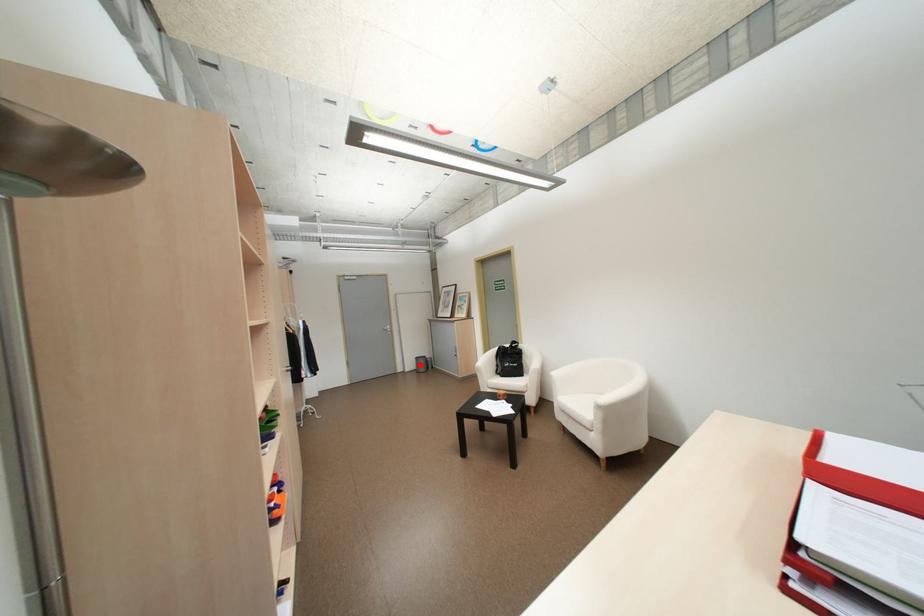
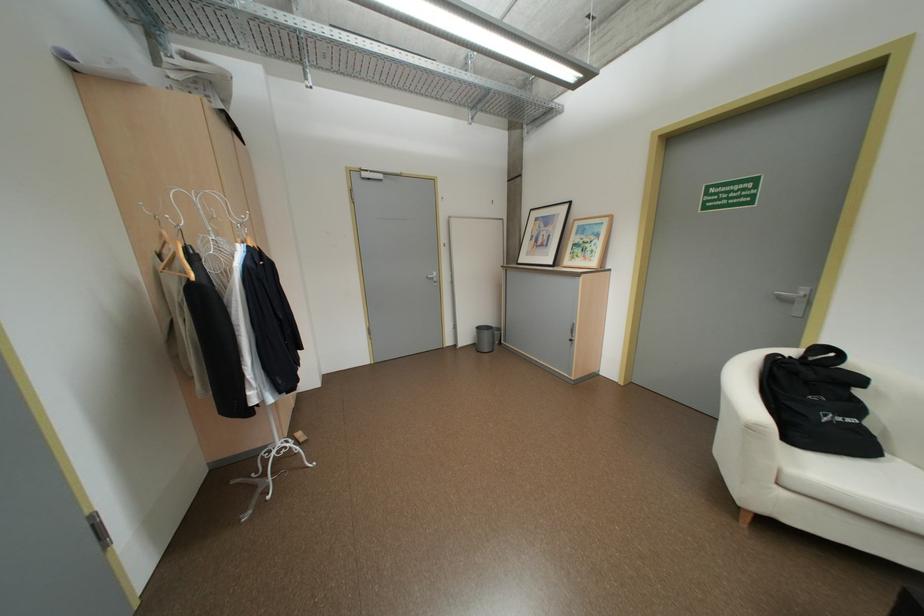
Question: I am providing you with two images of the same scene from different viewpoints. In image1, a red point is highlighted. Considering the same 3D point in image2, which of the following is correct?

Choices:
 (A) It is closer
 (B) It is farther

Answer: (B)